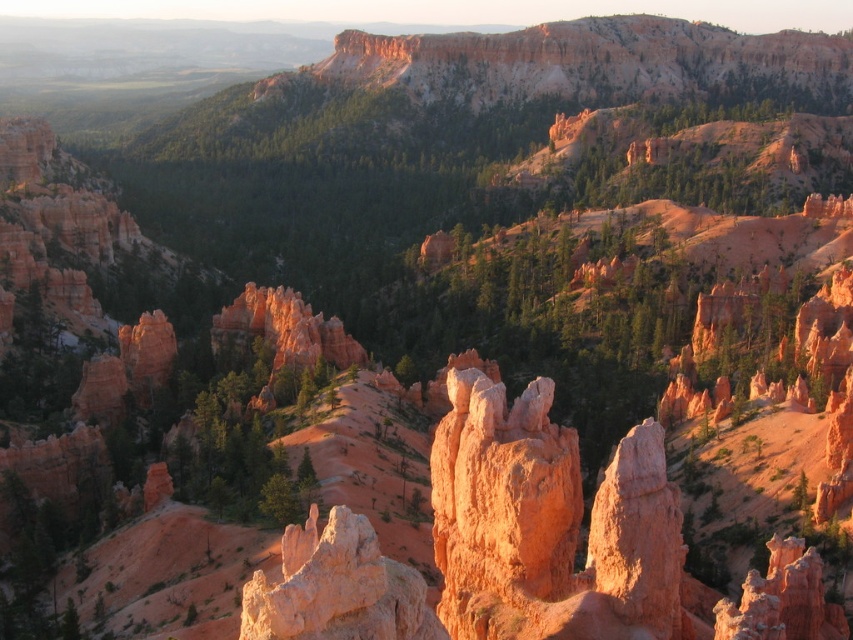
In the scene shown: You are standing at the base of the rugged desert landscape and see a point marked at coordinates (548, 524). According to the scene description, which object from the list contains this point?

The point at (548, 524) is located on the rustic sandstone spires at center.

You are standing in the desert landscape and want to touch the closest sandstone spire. Which one should you walk towards, the rustic sandstone spires at center or the rustic sandstone spire at center?

You should walk towards the rustic sandstone spire at center because it is closer to you than the rustic sandstone spires at center, which is further away.